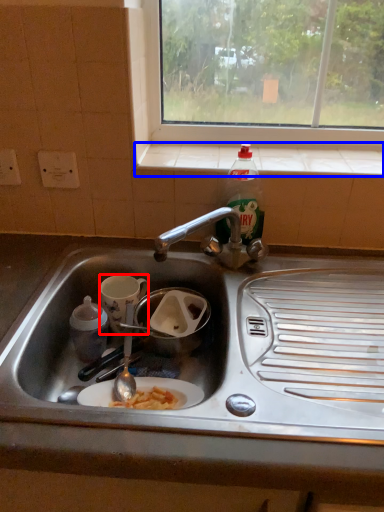
Question: Which point is closer to the camera, coffee cup (highlighted by a red box) or window sill (highlighted by a blue box)?

Choices:
 (A) coffee cup
 (B) window sill

Answer: (A)